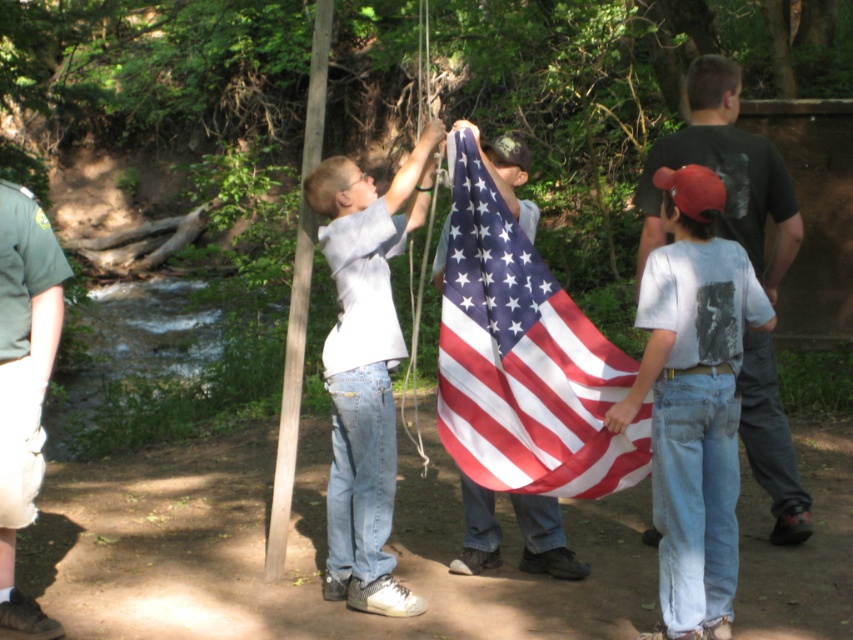
Question: Does american flag at center have a smaller size compared to smooth wooden pole at center?

Choices:
 (A) yes
 (B) no

Answer: (B)

Question: Does light blue jeans at center come in front of smooth wooden pole at center?

Choices:
 (A) yes
 (B) no

Answer: (A)

Question: Which is nearer to the green uniform at left?

Choices:
 (A) dark green t-shirt at center
 (B) denim jeans at center

Answer: (B)

Question: Which of these objects is positioned farthest from the american flag at center?

Choices:
 (A) denim jeans at center
 (B) dark green t-shirt at center

Answer: (B)

Question: Can you confirm if american flag at center is bigger than smooth wooden pole at center?

Choices:
 (A) yes
 (B) no

Answer: (A)

Question: Estimate the real-world distances between objects in this image. Which object is farther from the green uniform at left?

Choices:
 (A) smooth wooden pole at center
 (B) light blue jeans at center

Answer: (A)